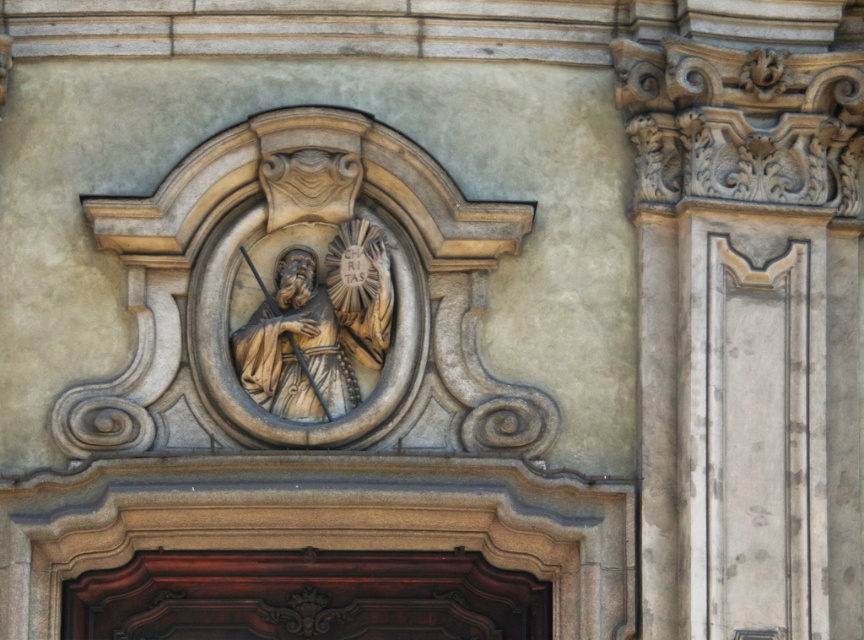
You are an architect examining the building facade. You need to determine which object, the polished dark wood door at center or the matte stone statue at center, would require more space if you were to replicate them at a 1.5 times scale. Which one would need more space?

The matte stone statue at center would require more space when scaled up to 1.5 times because it is larger in size than the polished dark wood door at center.

You are standing in front of the building and notice two central elements, the polished dark wood door at center and the matte stone statue at center. Which one is positioned more to the right?

The polished dark wood door at center is to the right of matte stone statue at center, so the polished dark wood door at center is positioned more to the right.